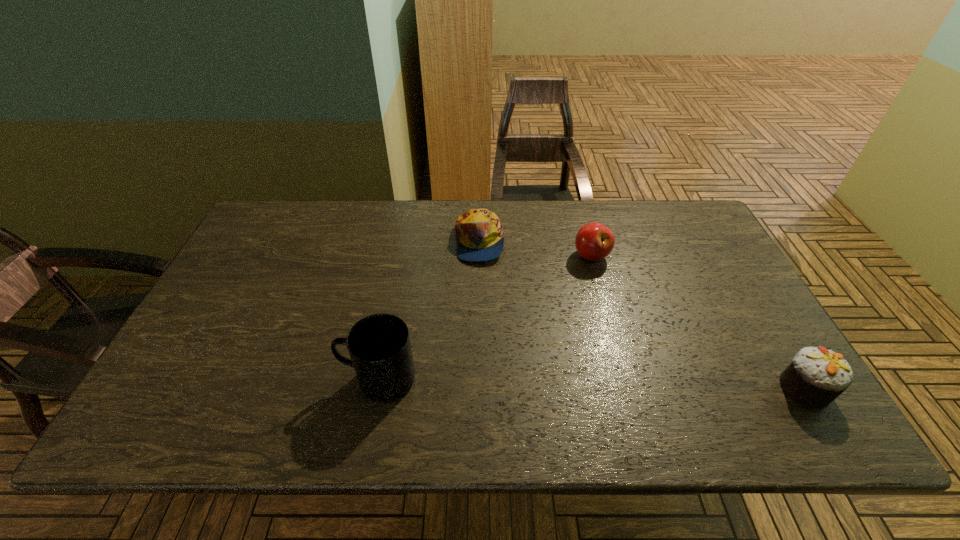
You are a GUI agent. You are given a task and a screenshot of the screen. Output one action in this format:
    pyautogui.click(x=<x>, y=<y>)
    Task: Click on the free location located on the bill of the cap
    
    Given the screenshot: What is the action you would take?
    pyautogui.click(x=558, y=345)

Locate an element on the screen. This screenshot has height=540, width=960. vacant space located on the bill of the cap is located at coordinates (572, 363).

Identify the location of vacant region located 0.180m on the bill of the cap. (523, 302).

The height and width of the screenshot is (540, 960). Identify the location of free space located 0.150m on the stem of the apple. (582, 305).

Locate an element on the screen. vacant area situated 0.360m on the stem of the apple is located at coordinates (569, 368).

Find the location of a particular element. The image size is (960, 540). vacant area situated 0.370m on the stem of the apple is located at coordinates (568, 371).

Where is `cap situated at the far edge`? cap situated at the far edge is located at coordinates (480, 234).

Where is `apple present at the far edge`? apple present at the far edge is located at coordinates (594, 241).

The image size is (960, 540). Find the location of `mug situated at the near edge`. mug situated at the near edge is located at coordinates (379, 345).

The image size is (960, 540). I want to click on cupcake present at the near edge, so pyautogui.click(x=816, y=377).